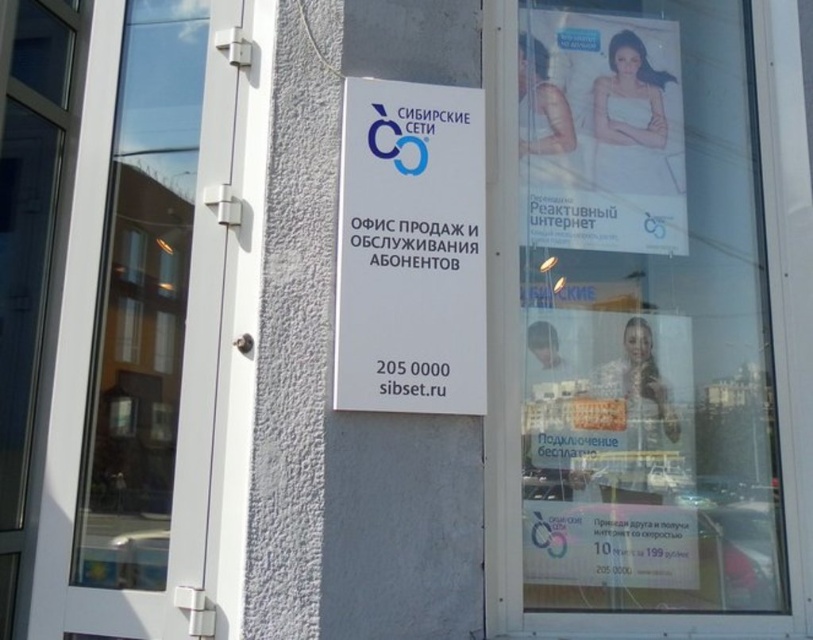
Between point (116, 400) and point (405, 332), which one is positioned in front?

Point (405, 332) is in front.

Does transparent glass window at left lie in front of white plastic sign at center?

No, transparent glass window at left is further to the viewer.

Which is behind, point (170, 509) or point (446, 257)?

Positioned behind is point (446, 257).

The height and width of the screenshot is (640, 813). Find the location of `transparent glass window at left`. transparent glass window at left is located at coordinates (142, 298).

Based on the photo, does white paper poster at upper right have a lesser height compared to white glossy poster at upper right?

No.

Which is above, white paper poster at upper right or white glossy poster at upper right?

white glossy poster at upper right

At what (x,y) coordinates should I click in order to perform the action: click on white paper poster at upper right. Please return your answer as a coordinate pair (x, y). Looking at the image, I should click on point(646,323).

Which is more to the right, white paper poster at upper right or white plastic sign at center?

From the viewer's perspective, white paper poster at upper right appears more on the right side.

Can you confirm if white paper poster at upper right is wider than white plastic sign at center?

Indeed, white paper poster at upper right has a greater width compared to white plastic sign at center.

Does point (694, 413) come behind point (394, 388)?

Yes, it is.

At what (x,y) coordinates should I click in order to perform the action: click on white paper poster at upper right. Please return your answer as a coordinate pair (x, y). The image size is (813, 640). Looking at the image, I should click on (646, 323).